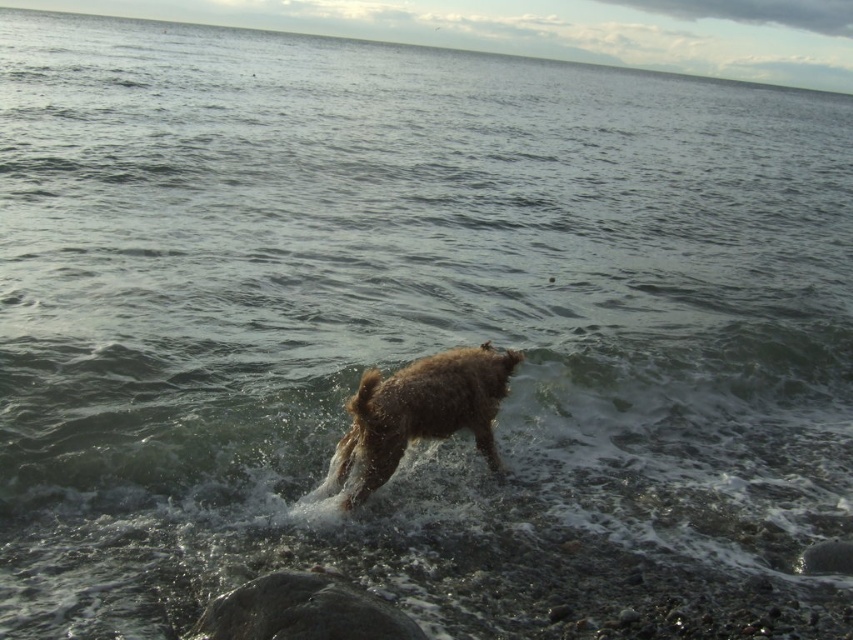
Question: Which point is closer to the camera?

Choices:
 (A) (405, 403)
 (B) (230, 616)

Answer: (B)

Question: Can you confirm if brown furry dog at center is wider than smooth gray rock at lower center?

Choices:
 (A) yes
 (B) no

Answer: (A)

Question: Is brown furry dog at center positioned behind smooth gray rock at lower center?

Choices:
 (A) no
 (B) yes

Answer: (B)

Question: Where is brown furry dog at center located in relation to smooth gray rock at lower center in the image?

Choices:
 (A) right
 (B) left

Answer: (A)

Question: Which of the following is the closest to the observer?

Choices:
 (A) smooth gray rock at lower center
 (B) brown furry dog at center

Answer: (A)